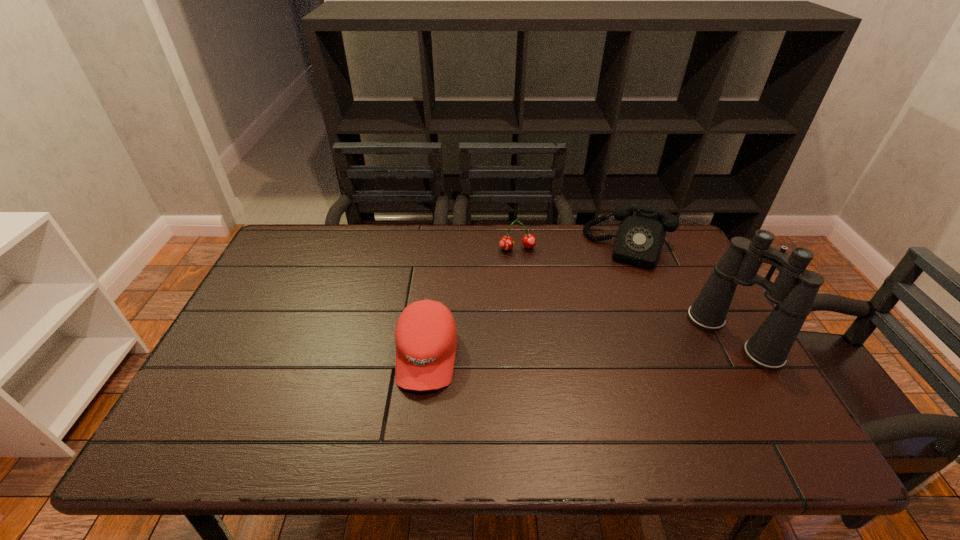
Identify the location of vacant space on the desktop that is between the cap and the tallest object and is positioned on the dial of the telephone. This screenshot has width=960, height=540. (599, 345).

Identify the location of vacant spot on the desktop that is between the cap and the tallest object and is positioned with stems pointing upwards on the cherry. (546, 348).